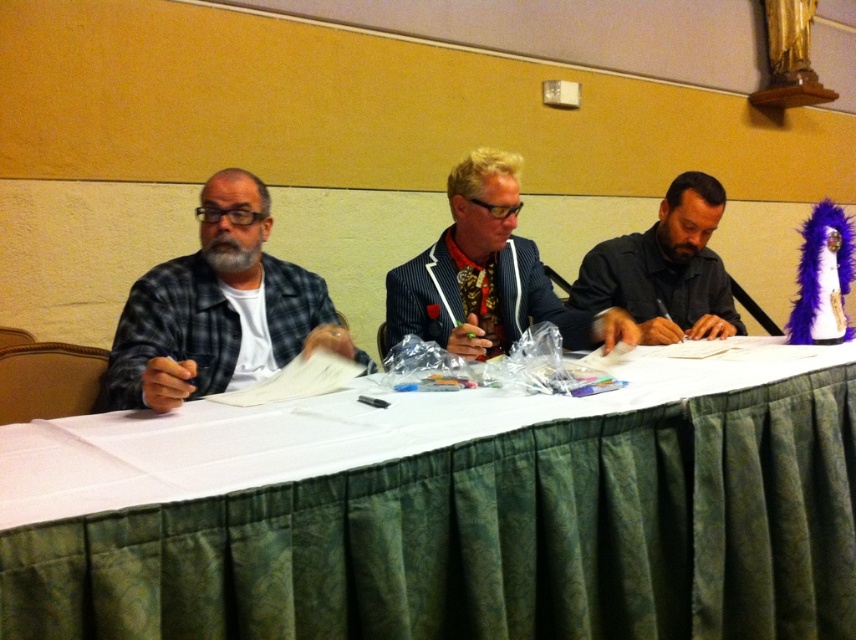
What do you see at coordinates (479, 272) in the screenshot? I see `striped fabric suit at center` at bounding box center [479, 272].

Between point (531, 314) and point (658, 294), which one is positioned behind?

The point (658, 294) is behind.

Find the location of a particular element. striped fabric suit at center is located at coordinates (479, 272).

What do you see at coordinates (494, 536) in the screenshot?
I see `green textured tablecloth at center` at bounding box center [494, 536].

You are a GUI agent. You are given a task and a screenshot of the screen. Output one action in this format:
    pyautogui.click(x=<x>, y=<y>)
    Task: Click on the green textured tablecloth at center
    
    Given the screenshot: What is the action you would take?
    pyautogui.click(x=494, y=536)

Is green textured tablecloth at center thinner than plaid fabric shirt at left?

No.

Which is more to the right, green textured tablecloth at center or plaid fabric shirt at left?

green textured tablecloth at center

Where is `green textured tablecloth at center`? green textured tablecloth at center is located at coordinates click(494, 536).